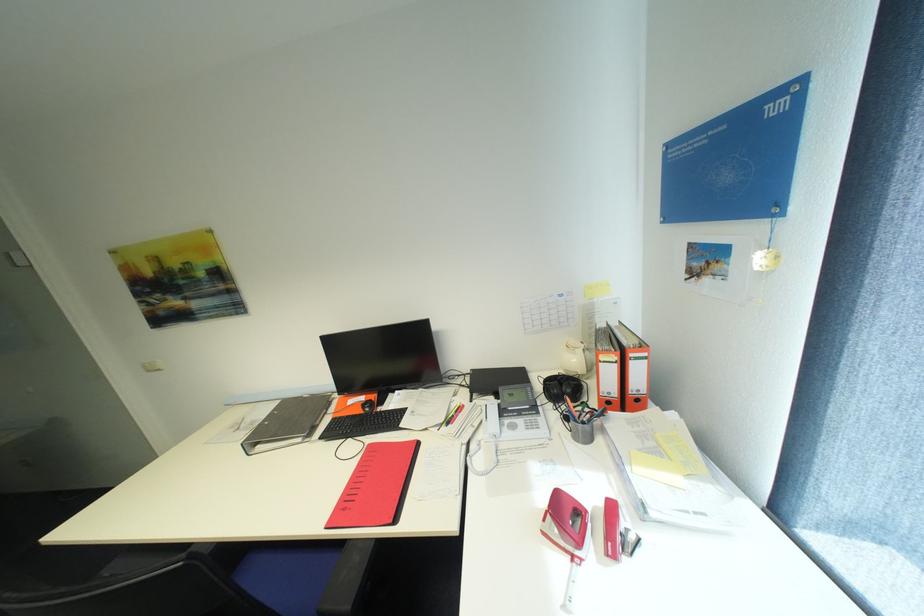
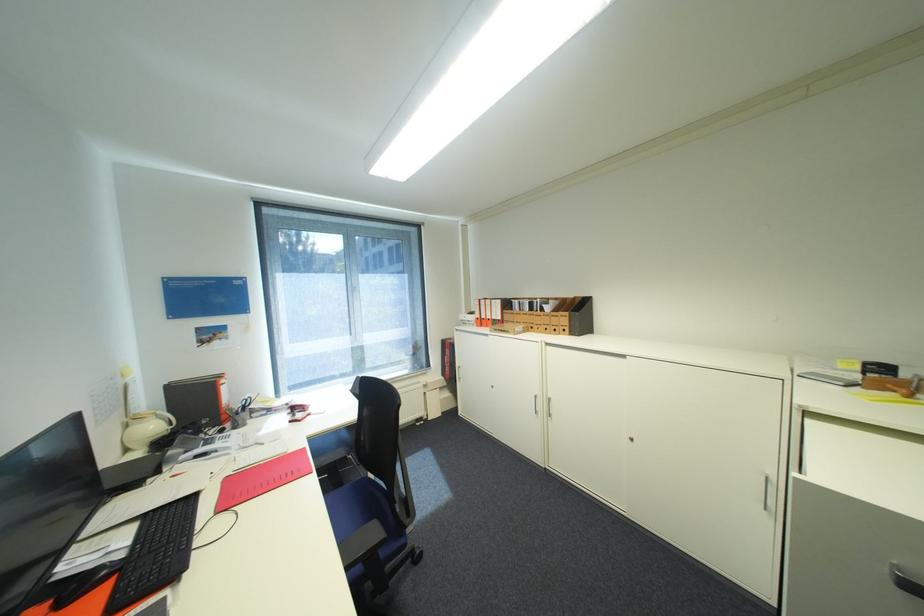
The point at (582,361) is marked in the first image. Where is the corresponding point in the second image?

(161, 427)